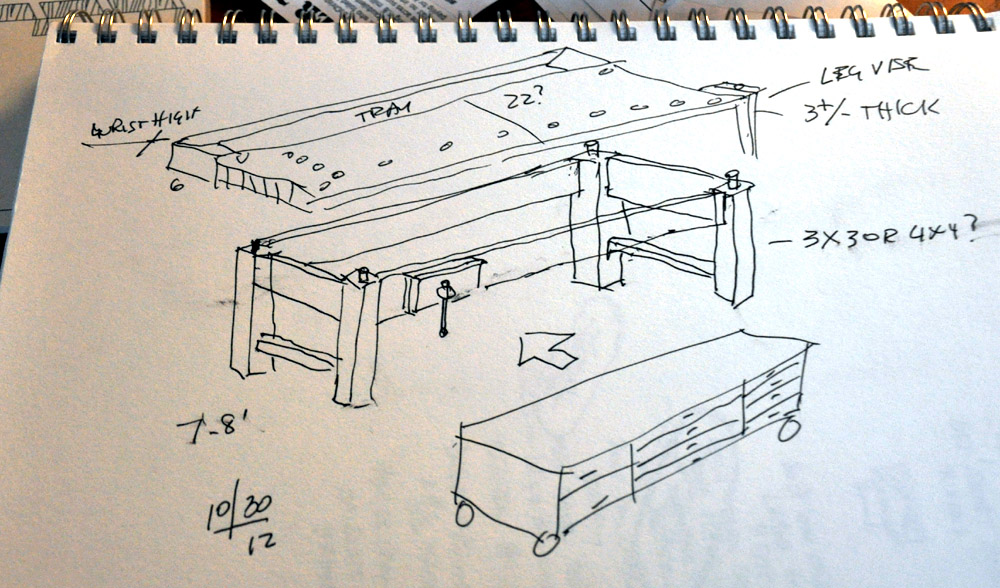
Image resolution: width=1000 pixels, height=588 pixels. Identify the location of right furniture legs. coord(246,356), coord(346,377).